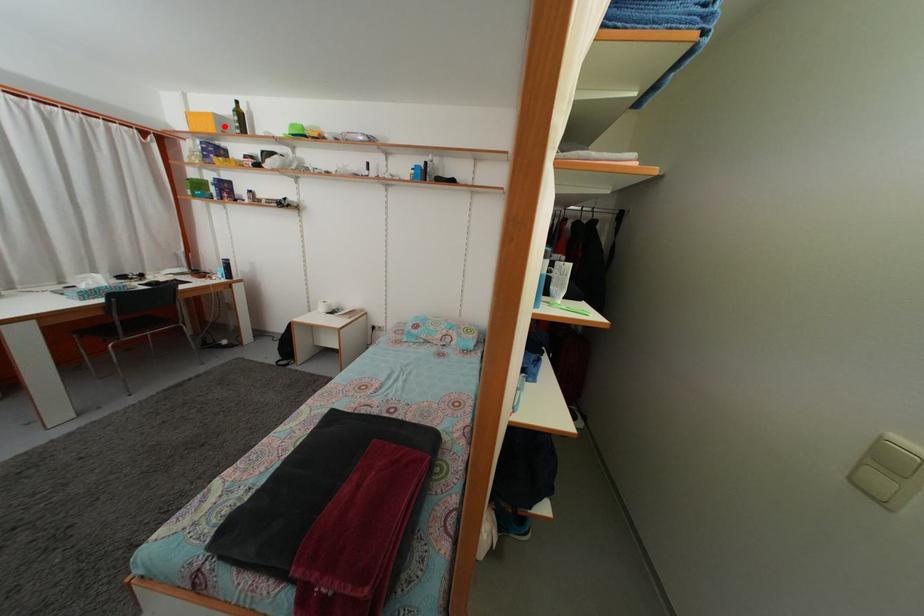
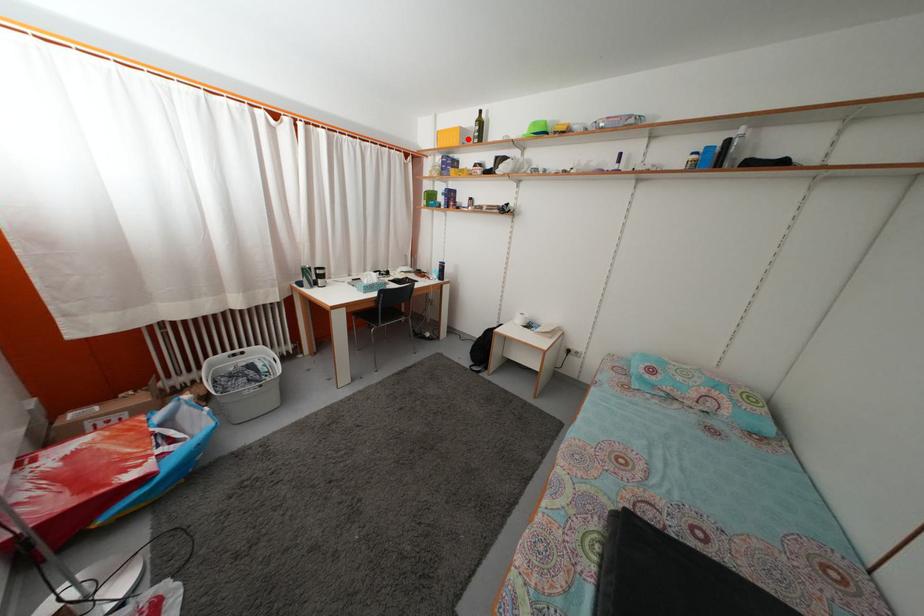
I am providing you with two images of the same scene from different viewpoints. A red point is marked on the first image and another point is marked on the second image. Is the red point in image1 aligned with the point shown in image2?

Yes